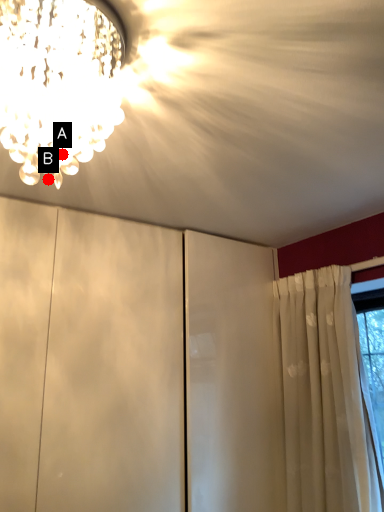
Question: Two points are circled on the image, labeled by A and B beside each circle. Which point appears closest to the camera in this image?

Choices:
 (A) A is closer
 (B) B is closer

Answer: (A)